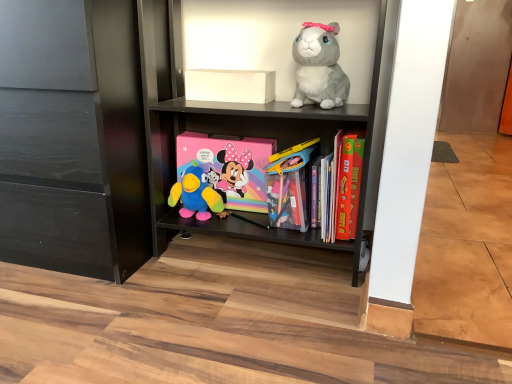
Question: From the image's perspective, is fluffy gray plush rabbit at upper right, which ranks as the third toy in left-to-right order, on pastel matte minnie mouse comic book at center?

Choices:
 (A) yes
 (B) no

Answer: (A)

Question: From a real-world perspective, is fluffy gray plush rabbit at upper right, the 1th toy viewed from the right, under pastel matte minnie mouse comic book at center?

Choices:
 (A) no
 (B) yes

Answer: (A)

Question: From a real-world perspective, is fluffy gray plush rabbit at upper right, the 1th toy viewed from the right, on top of pastel matte minnie mouse comic book at center?

Choices:
 (A) yes
 (B) no

Answer: (A)

Question: Is fluffy gray plush rabbit at upper right, the 1th toy viewed from the right, in front of pastel matte minnie mouse comic book at center?

Choices:
 (A) no
 (B) yes

Answer: (B)

Question: Does fluffy gray plush rabbit at upper right, the 1th toy viewed from the right, have a greater height compared to pastel matte minnie mouse comic book at center?

Choices:
 (A) yes
 (B) no

Answer: (B)

Question: Does point (305, 185) appear closer or farther from the camera than point (37, 107)?

Choices:
 (A) closer
 (B) farther

Answer: (B)

Question: From the image's perspective, relative to black matte cabinet at lower left, is translucent plastic container at center, the 2th toy positioned from the right, above or below?

Choices:
 (A) below
 (B) above

Answer: (A)

Question: Considering the positions of translucent plastic container at center, which is the second toy from left to right, and black matte cabinet at lower left in the image, is translucent plastic container at center, which is the second toy from left to right, taller or shorter than black matte cabinet at lower left?

Choices:
 (A) short
 (B) tall

Answer: (A)

Question: Is translucent plastic container at center, which is the second toy from left to right, to the left or to the right of black matte cabinet at lower left in the image?

Choices:
 (A) left
 (B) right

Answer: (B)

Question: Considering the positions of white matte box at upper center and hardcover book at center right in the image, is white matte box at upper center taller or shorter than hardcover book at center right?

Choices:
 (A) short
 (B) tall

Answer: (A)

Question: Is white matte box at upper center to the left or to the right of hardcover book at center right in the image?

Choices:
 (A) right
 (B) left

Answer: (B)

Question: From a real-world perspective, is white matte box at upper center positioned above or below hardcover book at center right?

Choices:
 (A) above
 (B) below

Answer: (A)

Question: Looking at the image, does white matte box at upper center seem bigger or smaller compared to hardcover book at center right?

Choices:
 (A) big
 (B) small

Answer: (B)

Question: Is point (289, 188) positioned closer to the camera than point (188, 216)?

Choices:
 (A) closer
 (B) farther

Answer: (A)

Question: Choose the correct answer: Is translucent plastic container at center, which is the second toy from left to right, inside plush blue bird at center, the 1th toy from the left, or outside it?

Choices:
 (A) outside
 (B) inside

Answer: (A)